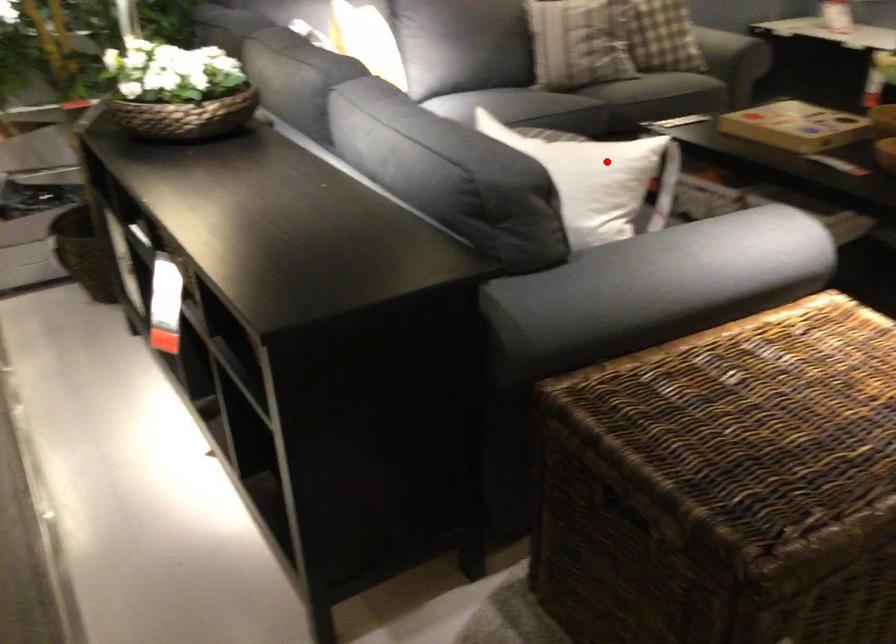
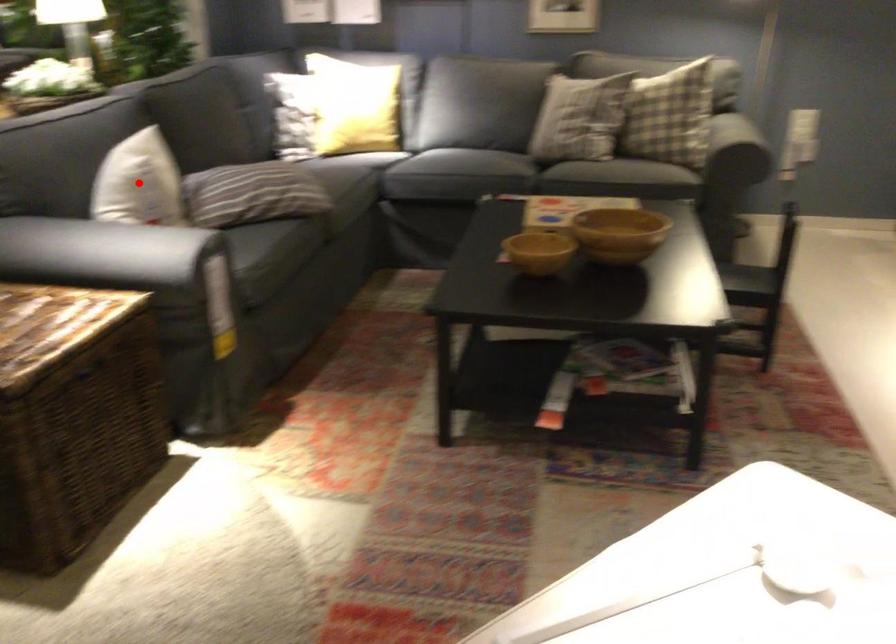
I am providing you with two images of the same scene from different viewpoints. A red point is marked on the first image and another point is marked on the second image. Is the red point in image1 aligned with the point shown in image2?

Yes